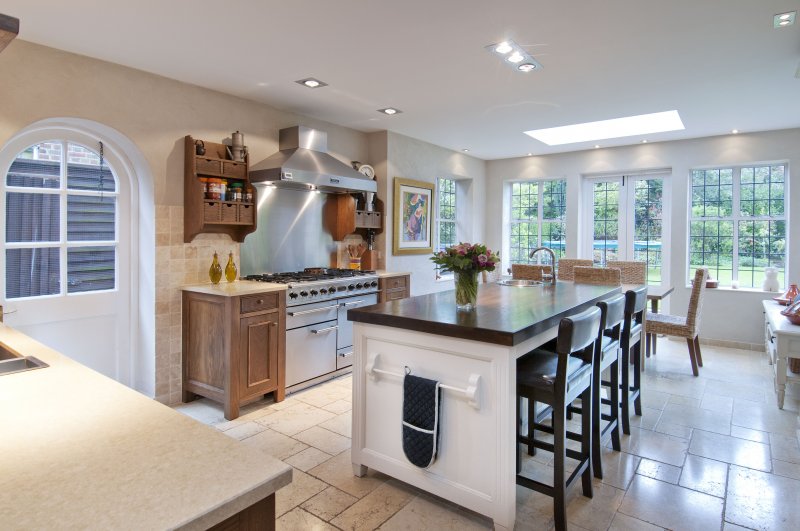
This screenshot has width=800, height=531. Find the location of `stool`. stool is located at coordinates (572, 382), (626, 340).